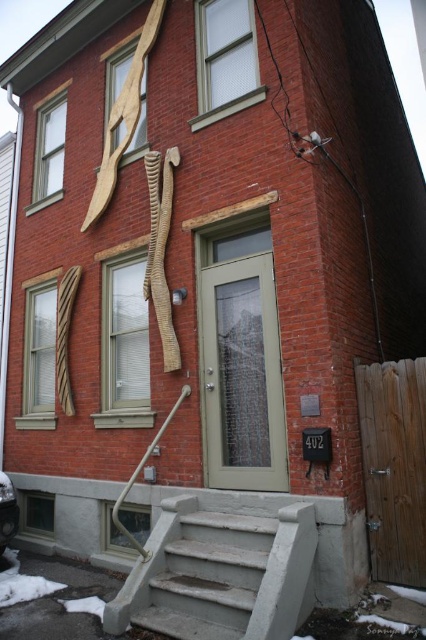
You are standing at the entrance of the two story brick building and want to go up the concrete steps at center. Is the brushed metal handrail at lower center within your reach as you climb the steps?

The concrete steps at center is shorter than the brushed metal handrail at lower center, so the handrail is taller and within reach as you climb the steps.

You are a delivery person with a cart that is 2 meters wide. You need to move your cart from the street to the entrance of the building. The entrance has a light green door with a glass panel. Is there enough space between the concrete steps at center to maneuver your cart through?

The concrete steps at center are 3.60 meters apart. Since your cart is 2 meters wide, there is sufficient space to maneuver the cart through the concrete steps at center.

In the scene shown: You are a delivery person carrying a large package and need to climb the concrete steps at center. The brushed metal handrail at lower center is nearby. Can you safely hold onto the handrail while carrying the package up the steps?

The concrete steps at center and brushed metal handrail at lower center are 32.11 inches apart from each other. Since this distance allows for comfortable reach, you can safely hold onto the brushed metal handrail at lower center while carrying the package up the concrete steps at center.